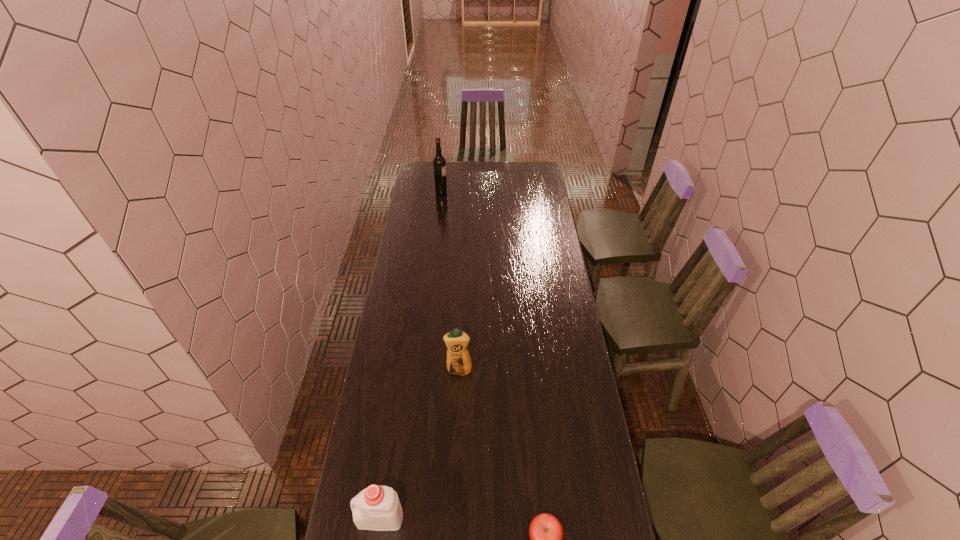
Where is `vacant region that satisfies the following two spatial constraints: 1. on the label of the second object from right to left; 2. on the handle side of the nearer detergent`? The height and width of the screenshot is (540, 960). vacant region that satisfies the following two spatial constraints: 1. on the label of the second object from right to left; 2. on the handle side of the nearer detergent is located at coordinates (453, 518).

The height and width of the screenshot is (540, 960). I want to click on vacant space that satisfies the following two spatial constraints: 1. on the label of the farther detergent; 2. on the handle side of the nearer detergent, so click(453, 518).